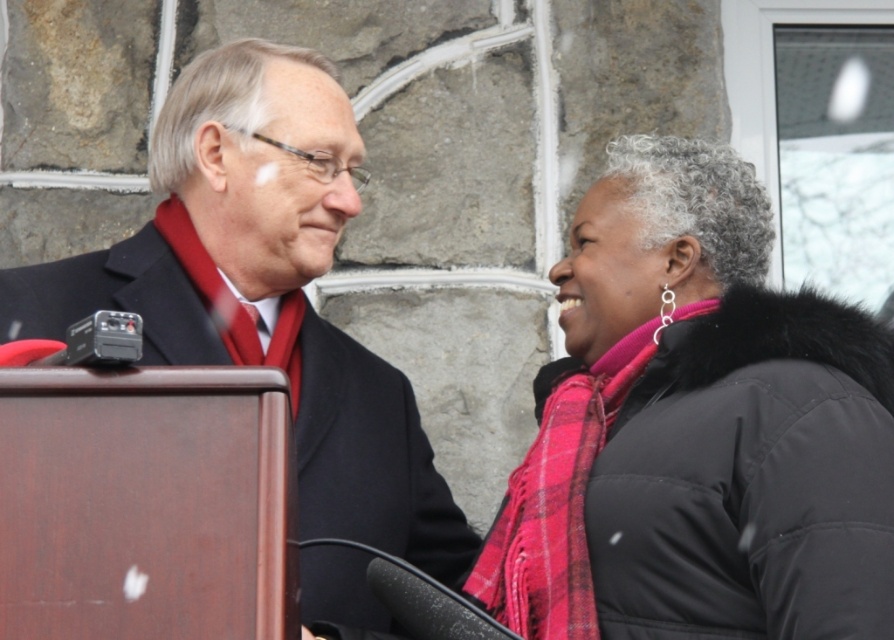
You are standing in front of the stone wall and window frame, and you see two points marked in the image. The first point is at coordinates point (291, 296) and the second point is at point (578, 492). Which point is closer to you?

Point (291, 296) is closer to you because it is further to the camera than point (578, 492).

You are a photographer trying to capture a clear shot of both the pink plaid scarf at right and the matte black suit at center. Based on their positions, which object should you focus on first to ensure both are in frame?

The pink plaid scarf at right is positioned under the matte black suit at center, so you should focus on the matte black suit at center first to ensure both are in frame.